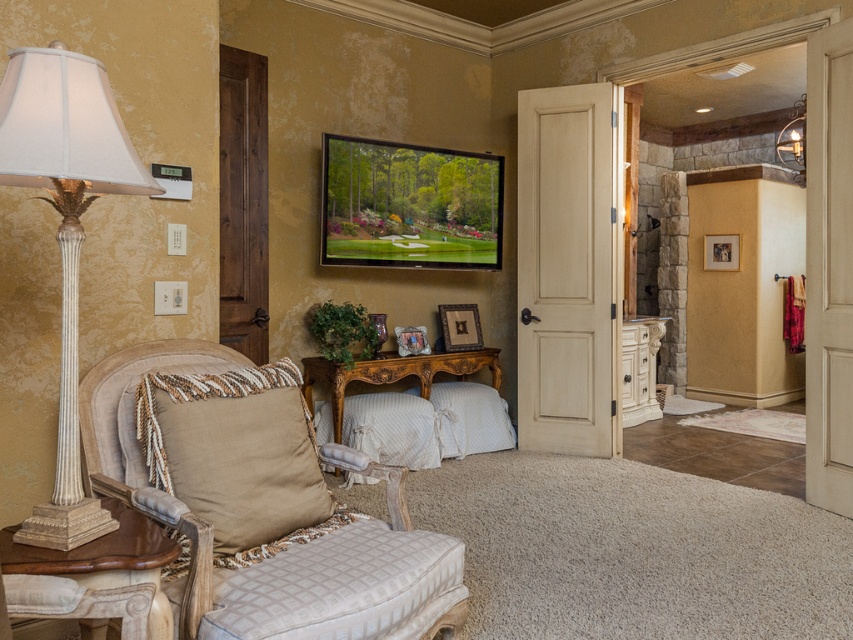
Looking at this image, you are standing in the living room and want to sit on the white quilted fabric stool at lower left. Which direction should you move from your current position at point (340,588)?

The point (340,588) corresponds to the white quilted fabric stool at lower left, so you are already at the stool.

You are sitting on the sofa and want to place a book on the nearest surface. Which object between the beige fabric pillow at lower left and the wooden carved console table at center is closer to you?

The beige fabric pillow at lower left is closer to you since it is positioned to the left of the wooden carved console table at center, making it the nearest surface available.

You are standing in the living room and want to move from the vintage armchair to the wooden console table. The coordinates of the armchair are point [178,476] and the console table is at point [335,410]. Which point should you head towards first to reach the console table?

You should head towards point [178,476] first because it is in front of point [335,410], meaning it is closer to your current position near the vintage armchair.